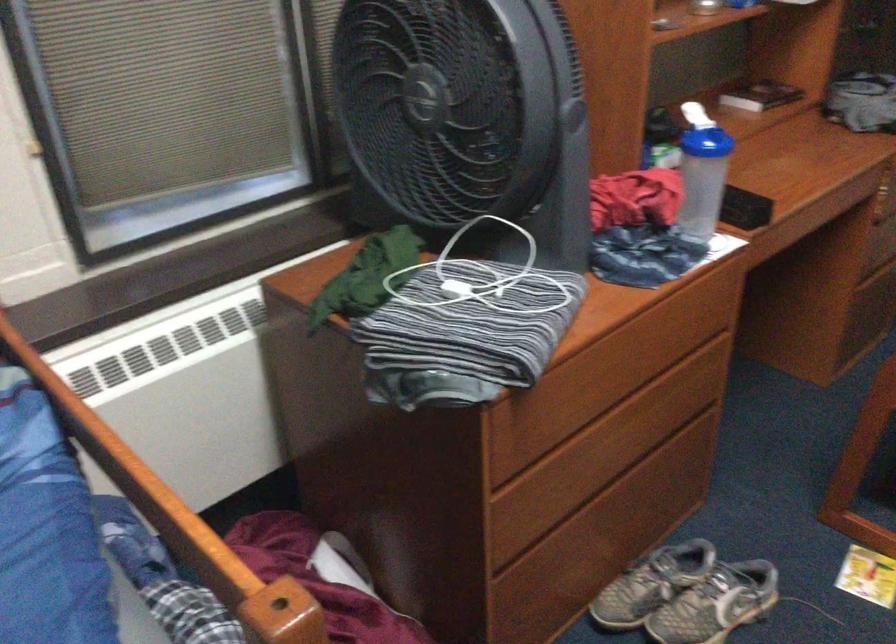
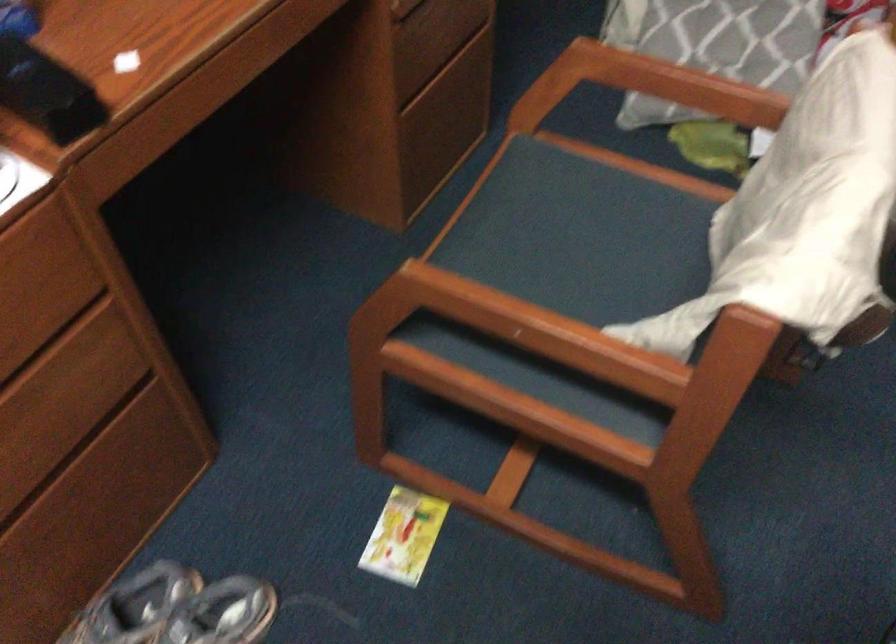
Which direction would the cameraman need to move to produce the second image?

The cameraman moved toward right, forward.